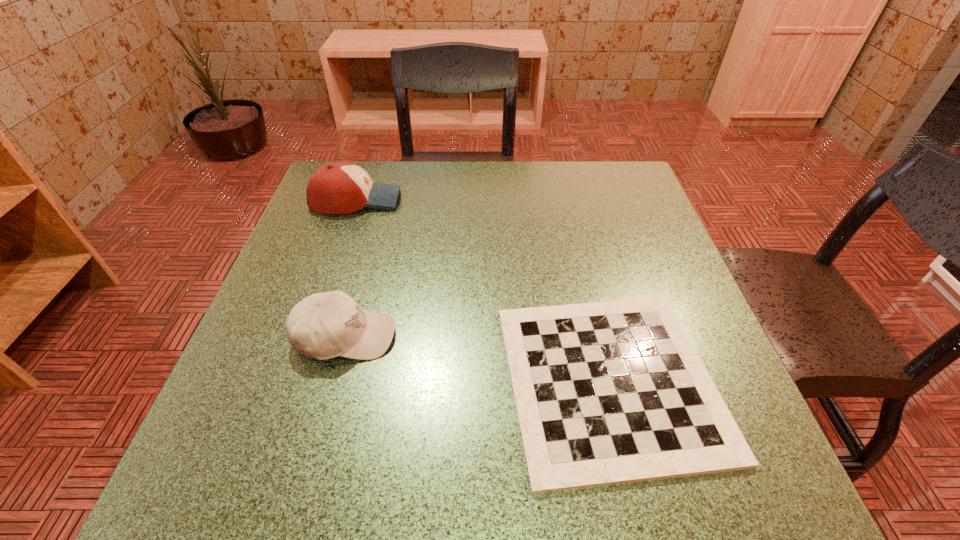
Locate an element on the screen. free space that satisfies the following two spatial constraints: 1. on the front-facing side of the shortest object; 2. on the left side of the nearer baseball cap is located at coordinates (333, 381).

Image resolution: width=960 pixels, height=540 pixels. In order to click on free region that satisfies the following two spatial constraints: 1. on the front-facing side of the nearer baseball cap; 2. on the left side of the checkerboard in this screenshot , I will do `click(333, 381)`.

Where is `vacant region that satisfies the following two spatial constraints: 1. on the front-facing side of the shortest object; 2. on the right side of the nearer baseball cap`? The image size is (960, 540). vacant region that satisfies the following two spatial constraints: 1. on the front-facing side of the shortest object; 2. on the right side of the nearer baseball cap is located at coordinates (333, 381).

You are a GUI agent. You are given a task and a screenshot of the screen. Output one action in this format:
    pyautogui.click(x=<x>, y=<y>)
    Task: Click on the vacant space that satisfies the following two spatial constraints: 1. on the front-facing side of the shortest object; 2. on the left side of the farther baseball cap
    The height and width of the screenshot is (540, 960).
    Given the screenshot: What is the action you would take?
    pyautogui.click(x=294, y=381)

Locate an element on the screen. The width and height of the screenshot is (960, 540). free space in the image that satisfies the following two spatial constraints: 1. on the back side of the rightmost object; 2. on the front-facing side of the nearer baseball cap is located at coordinates (599, 336).

At what (x,y) coordinates should I click in order to perform the action: click on free spot that satisfies the following two spatial constraints: 1. on the front-facing side of the nearer baseball cap; 2. on the left side of the shortest object. Please return your answer as a coordinate pair (x, y). Looking at the image, I should click on (333, 381).

The width and height of the screenshot is (960, 540). Find the location of `free space that satisfies the following two spatial constraints: 1. on the front-facing side of the nearer baseball cap; 2. on the right side of the checkerboard`. free space that satisfies the following two spatial constraints: 1. on the front-facing side of the nearer baseball cap; 2. on the right side of the checkerboard is located at coordinates (x=333, y=381).

Where is `vacant space that satisfies the following two spatial constraints: 1. on the back side of the checkerboard; 2. on the front-facing side of the nearer baseball cap`? Image resolution: width=960 pixels, height=540 pixels. vacant space that satisfies the following two spatial constraints: 1. on the back side of the checkerboard; 2. on the front-facing side of the nearer baseball cap is located at coordinates (599, 336).